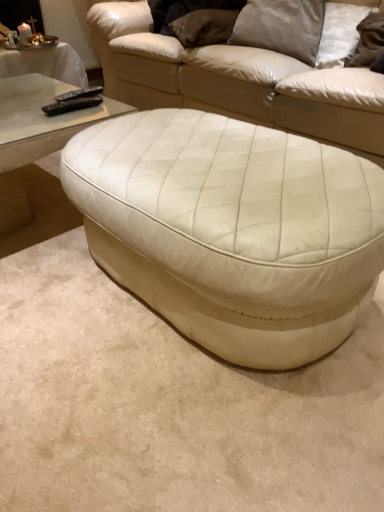
Question: From a real-world perspective, is white leather ottoman at center on top of black plastic remote at upper left, the first remote when ordered from front to back?

Choices:
 (A) yes
 (B) no

Answer: (B)

Question: Is white leather ottoman at center to the right of black plastic remote at upper left, acting as the 2th remote starting from the back, from the viewer's perspective?

Choices:
 (A) no
 (B) yes

Answer: (B)

Question: Is white leather ottoman at center located outside black plastic remote at upper left, the first remote when ordered from front to back?

Choices:
 (A) no
 (B) yes

Answer: (B)

Question: Is white leather ottoman at center positioned before black plastic remote at upper left, acting as the 2th remote starting from the back?

Choices:
 (A) yes
 (B) no

Answer: (A)

Question: Is black plastic remote at upper left, the first remote when ordered from front to back, located within white leather ottoman at center?

Choices:
 (A) yes
 (B) no

Answer: (B)

Question: From the image's perspective, is satin gray pillow at upper center, which appears as the 2th pillow when viewed from the right, above or below suede-like beige pillow at upper center, placed as the 1th pillow when sorted from left to right?

Choices:
 (A) above
 (B) below

Answer: (B)

Question: In terms of height, does satin gray pillow at upper center, placed as the second pillow when sorted from left to right, look taller or shorter compared to suede-like beige pillow at upper center, placed as the 1th pillow when sorted from left to right?

Choices:
 (A) short
 (B) tall

Answer: (B)

Question: From a real-world perspective, is satin gray pillow at upper center, placed as the second pillow when sorted from left to right, above or below suede-like beige pillow at upper center, placed as the 1th pillow when sorted from left to right?

Choices:
 (A) below
 (B) above

Answer: (B)

Question: Based on their sizes in the image, would you say satin gray pillow at upper center, which appears as the 2th pillow when viewed from the right, is bigger or smaller than suede-like beige pillow at upper center, placed as the 1th pillow when sorted from left to right?

Choices:
 (A) small
 (B) big

Answer: (B)

Question: In terms of width, does satin gray pillow at upper center, placed as the second pillow when sorted from left to right, look wider or thinner when compared to black plastic remote at upper left, acting as the 2th remote starting from the back?

Choices:
 (A) wide
 (B) thin

Answer: (A)

Question: From a real-world perspective, is satin gray pillow at upper center, placed as the second pillow when sorted from left to right, above or below black plastic remote at upper left, acting as the 2th remote starting from the back?

Choices:
 (A) below
 (B) above

Answer: (B)

Question: Based on their sizes in the image, would you say satin gray pillow at upper center, placed as the second pillow when sorted from left to right, is bigger or smaller than black plastic remote at upper left, acting as the 2th remote starting from the back?

Choices:
 (A) big
 (B) small

Answer: (A)

Question: In the image, is satin gray pillow at upper center, placed as the second pillow when sorted from left to right, on the left side or the right side of black plastic remote at upper left, the first remote when ordered from front to back?

Choices:
 (A) left
 (B) right

Answer: (B)

Question: Is black plastic remote at upper left, acting as the 2th remote starting from the back, taller or shorter than white leather ottoman at center?

Choices:
 (A) short
 (B) tall

Answer: (A)

Question: Looking at the image, does black plastic remote at upper left, the first remote when ordered from front to back, seem bigger or smaller compared to white leather ottoman at center?

Choices:
 (A) big
 (B) small

Answer: (B)